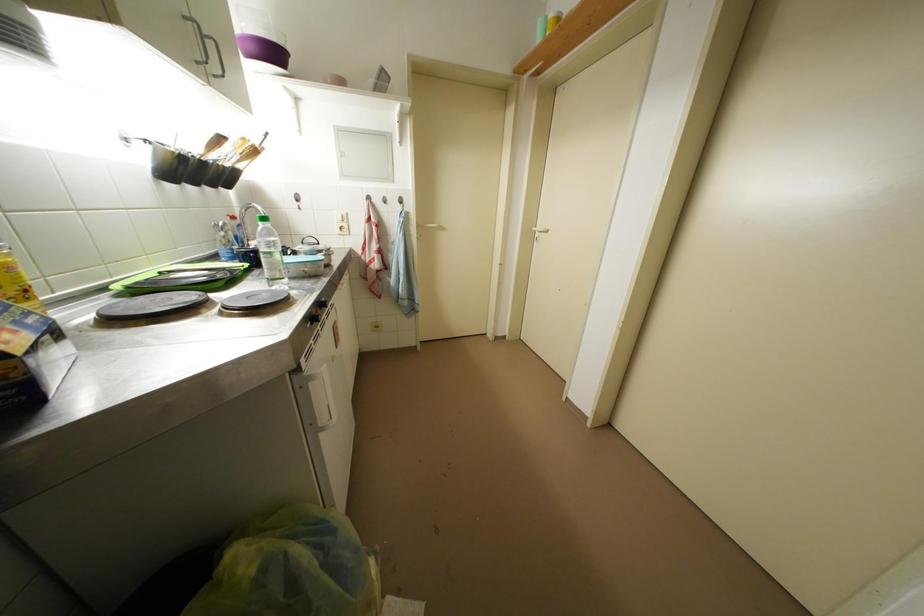
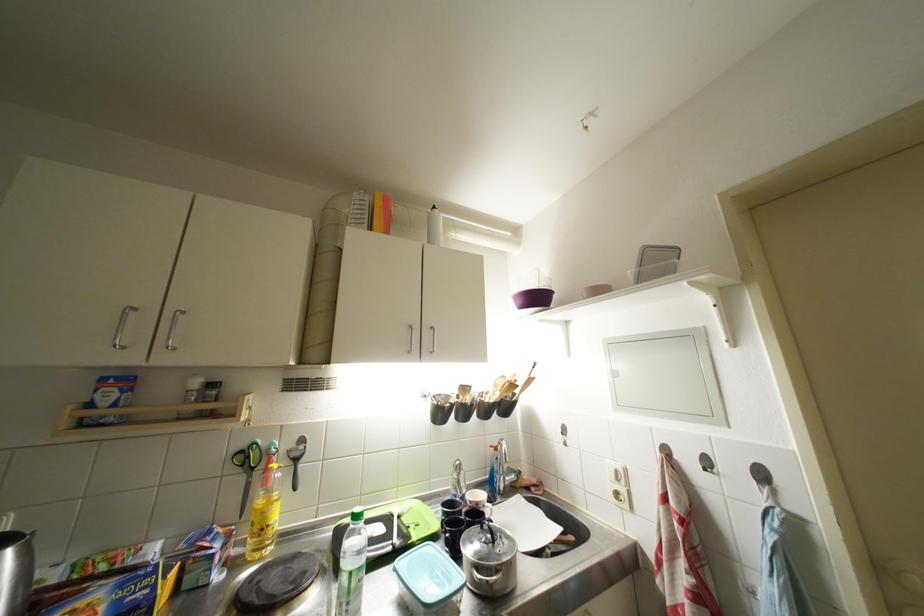
Locate, in the second image, the point that corresponds to point 259,53 in the first image.

(527, 306)